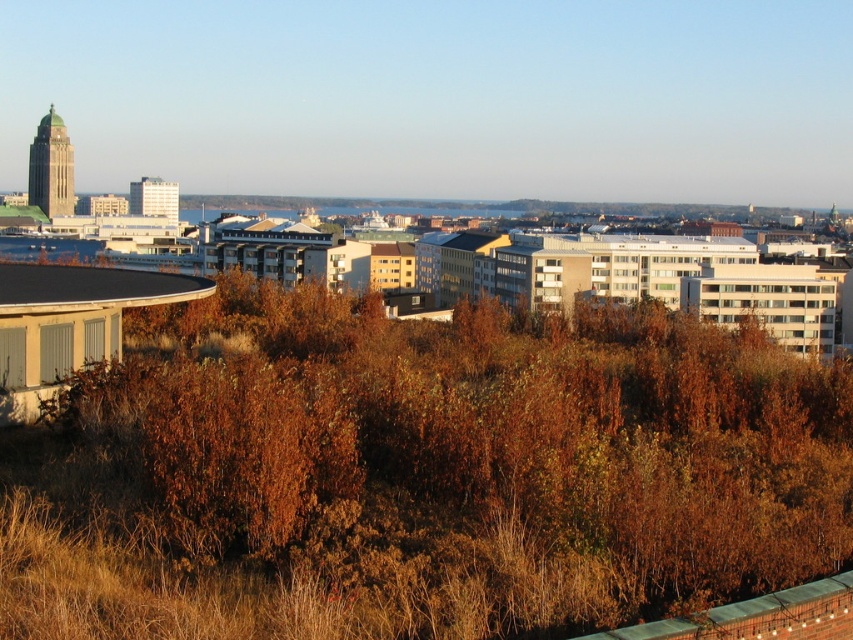
You are standing at the point marked by the coordinate point (x=467, y=458) in the cityscape image. Looking around, you notice a brown leafy shrub at left. What is the nearest building feature to your current position?

The nearest building feature to the point (x=467, y=458) is the brown leafy shrub at left, as it is directly marked by the coordinate point.

From the picture: You are standing at the center of the cityscape and want to take a photo of the blue glass water at lower left without the brown leafy shrub at left blocking the view. Is there a way to adjust your position to achieve this?

The brown leafy shrub at left is in front of the blue glass water at lower left, so moving to a position where you can see behind or around the shrub might allow you to capture the blue glass water at lower left without obstruction.